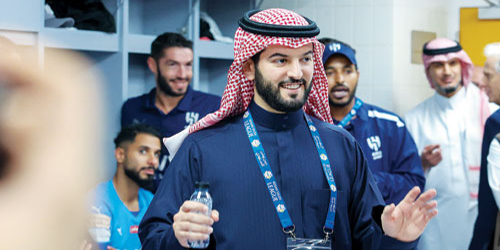
At what (x,y) coordinates should I click in order to perform the action: click on yellow coloured door. Please return your answer as a coordinate pair (x, y). Image resolution: width=500 pixels, height=250 pixels. Looking at the image, I should click on click(475, 30).